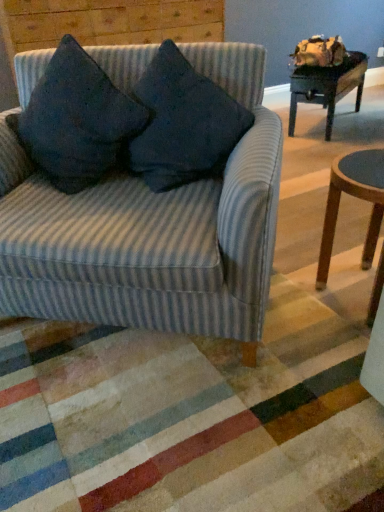
Question: From a real-world perspective, is dark blue fabric pillow at upper left, which appears as the first throw pillow when viewed from the left, above or below dark blue fabric cushion at upper left?

Choices:
 (A) below
 (B) above

Answer: (A)

Question: Visually, is dark blue fabric pillow at upper left, positioned as the second throw pillow in right-to-left order, positioned to the left or to the right of dark blue fabric cushion at upper left?

Choices:
 (A) right
 (B) left

Answer: (A)

Question: Estimate the real-world distances between objects in this image. Which object is farther from the dark blue fabric cushion at upper left?

Choices:
 (A) wooden round stool at lower right
 (B) striped fabric couch at left
 (C) dark blue fabric pillow at center, acting as the second throw pillow starting from the left
 (D) wooden table at upper right
 (E) dark blue fabric pillow at upper left, which appears as the first throw pillow when viewed from the left

Answer: (A)

Question: Which of these objects is positioned closest to the dark blue fabric pillow at center, which appears as the 1th throw pillow when viewed from the right?

Choices:
 (A) dark blue fabric cushion at upper left
 (B) striped fabric couch at left
 (C) dark blue fabric pillow at upper left, positioned as the second throw pillow in right-to-left order
 (D) wooden round stool at lower right
 (E) wooden table at upper right

Answer: (C)